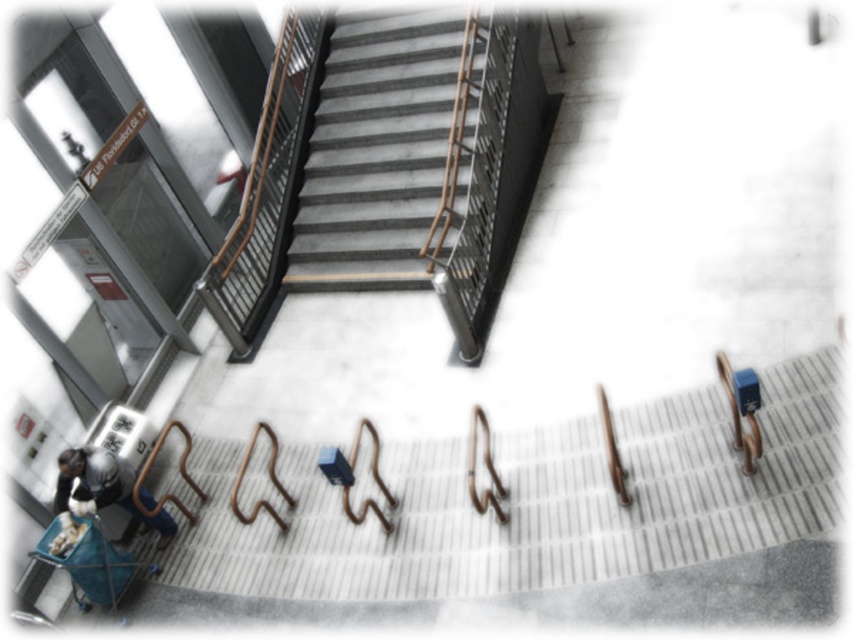
Does point (416, 22) come in front of point (103, 486)?

No, (416, 22) is further to viewer.

Who is higher up, gray concrete stairs at center or dark gray fabric bag at lower left?

gray concrete stairs at center is higher up.

Does point (432, 192) lie behind point (79, 502)?

That is True.

You are a GUI agent. You are given a task and a screenshot of the screen. Output one action in this format:
    pyautogui.click(x=<x>, y=<y>)
    Task: Click on the gray concrete stairs at center
    
    Given the screenshot: What is the action you would take?
    [x=387, y=150]